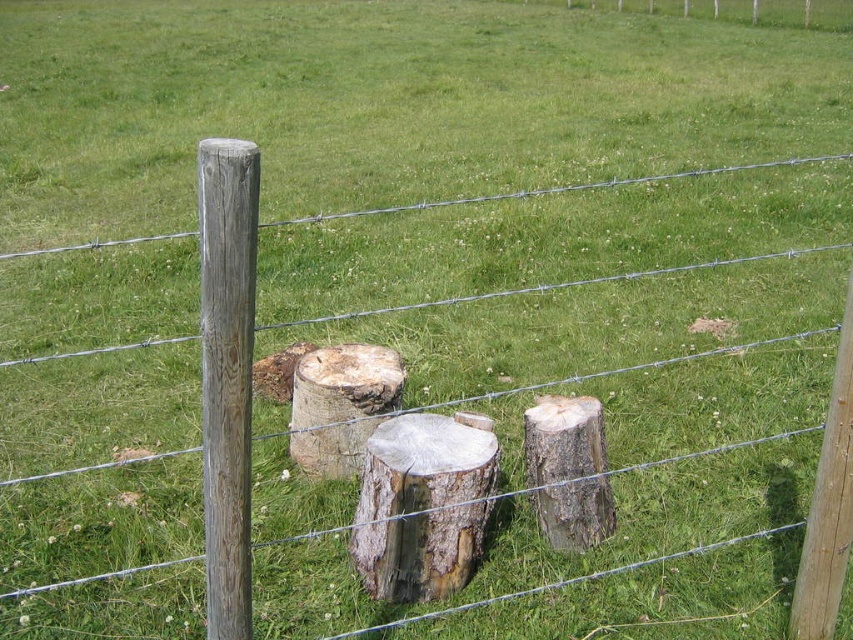
Question: Among these objects, which one is nearest to the camera?

Choices:
 (A) smooth brown stump at center
 (B) brown wood post at left
 (C) rough bark stump at center
 (D) natural wood stump at center

Answer: (B)

Question: Is the position of smooth brown stump at center more distant than that of natural wood stump at center?

Choices:
 (A) yes
 (B) no

Answer: (B)

Question: Does brown wood post at left appear over smooth brown stump at center?

Choices:
 (A) no
 (B) yes

Answer: (B)

Question: Which point appears closest to the camera in this image?

Choices:
 (A) (225, 333)
 (B) (494, 483)

Answer: (A)

Question: Does brown wood post at left appear over rough bark stump at center?

Choices:
 (A) yes
 (B) no

Answer: (A)

Question: Which is farther from the smooth brown stump at center?

Choices:
 (A) rough bark stump at center
 (B) brown wood post at left

Answer: (B)